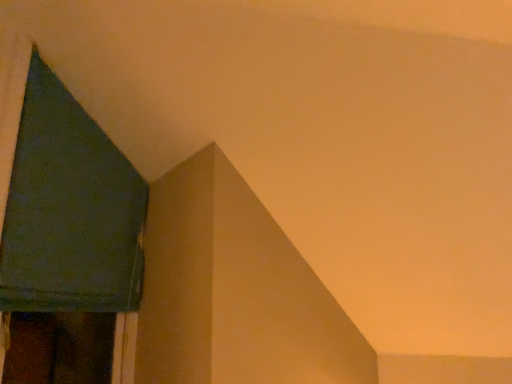
Find the location of a particular element. The height and width of the screenshot is (384, 512). dark green fabric at left is located at coordinates (69, 210).

The width and height of the screenshot is (512, 384). Describe the element at coordinates (69, 210) in the screenshot. I see `dark green fabric at left` at that location.

You are a GUI agent. You are given a task and a screenshot of the screen. Output one action in this format:
    pyautogui.click(x=<x>, y=<y>)
    Task: Click on the dark green fabric at left
    
    Given the screenshot: What is the action you would take?
    pyautogui.click(x=69, y=210)